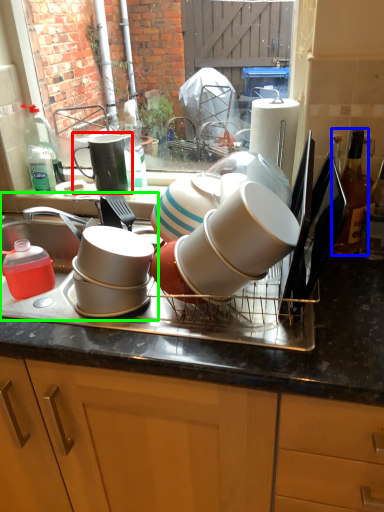
Question: Which is farther away from tableware (highlighted by a red box)? bottle (highlighted by a blue box) or sink (highlighted by a green box)?

Choices:
 (A) bottle
 (B) sink

Answer: (A)